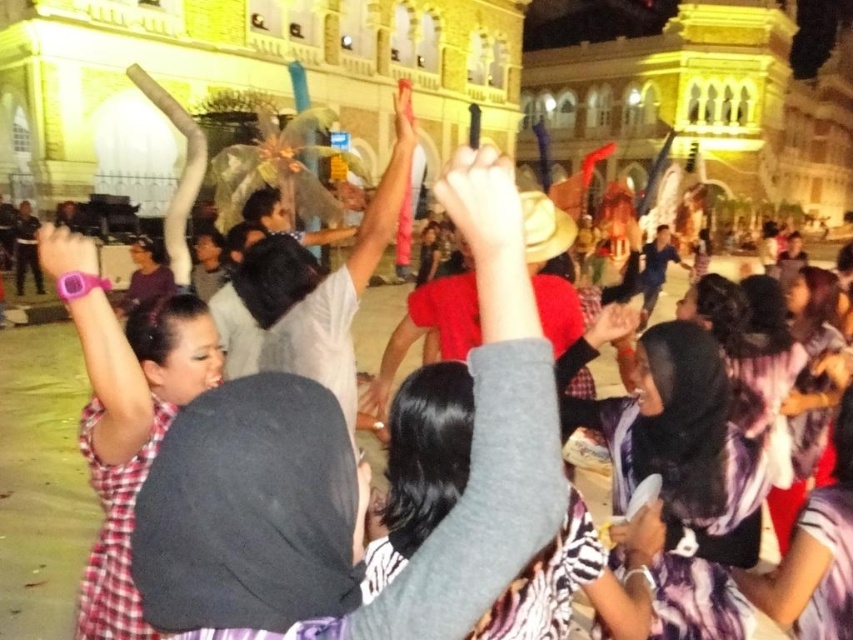
Looking at this image, you are observing a cultural performance where two participants have their hands raised. Which hand is positioned to the right of the other? The hands are labeled as smooth skin hand at center and matte black hand at center.

The smooth skin hand at center is positioned to the right of the matte black hand at center.